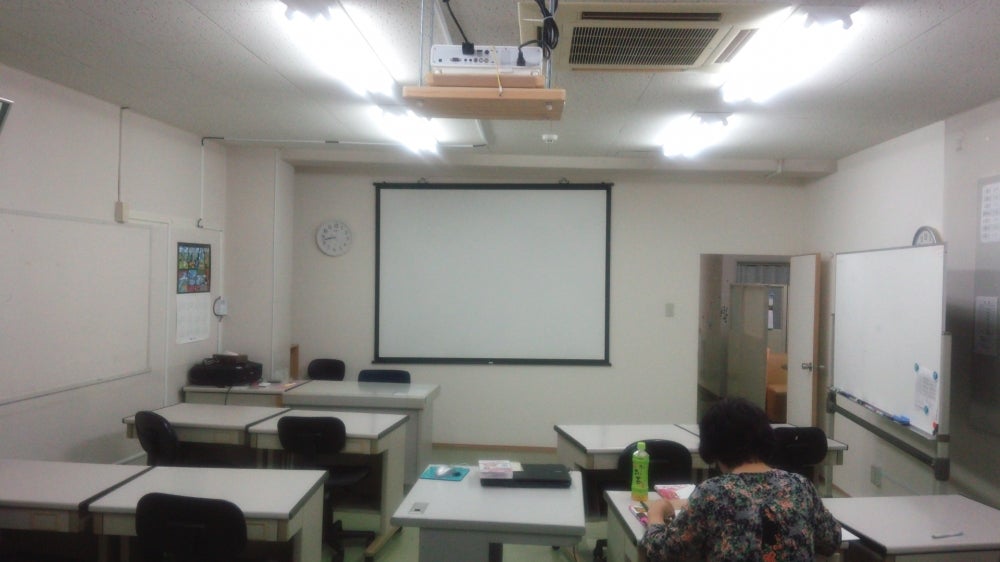
You are a GUI agent. You are given a task and a screenshot of the screen. Output one action in this format:
    pyautogui.click(x=<x>, y=<y>)
    Task: Click on the calendar
    The width and height of the screenshot is (1000, 562).
    Given the screenshot: What is the action you would take?
    pyautogui.click(x=180, y=244), pyautogui.click(x=198, y=270), pyautogui.click(x=172, y=317), pyautogui.click(x=204, y=309), pyautogui.click(x=163, y=255)